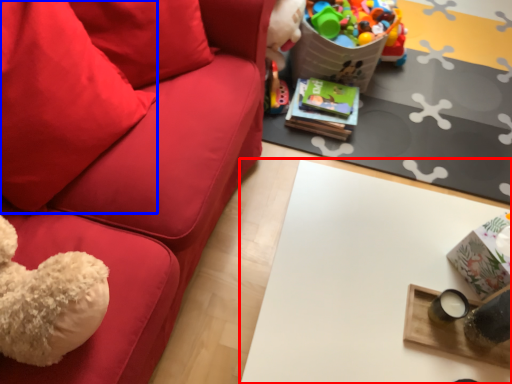
Question: Which object appears farthest to the camera in this image, table (highlighted by a red box) or pillow (highlighted by a blue box)?

Choices:
 (A) table
 (B) pillow

Answer: (A)